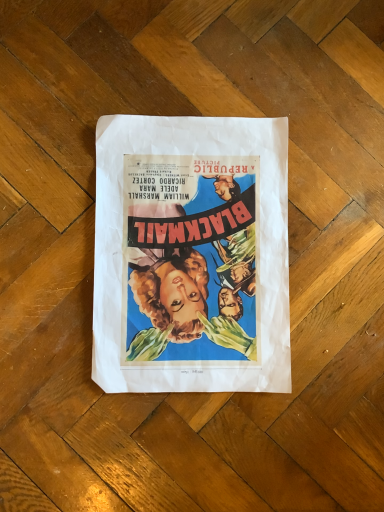
Locate an element on the screen. Image resolution: width=384 pixels, height=512 pixels. free space above matte paper poster at center (from a real-world perspective) is located at coordinates (205, 239).